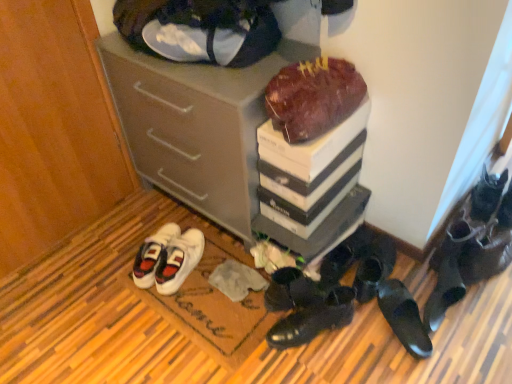
I want to click on free space above shiny black shoes at lower right, which ranks as the 5th footwear in left-to-right order (from a real-world perspective), so click(x=373, y=265).